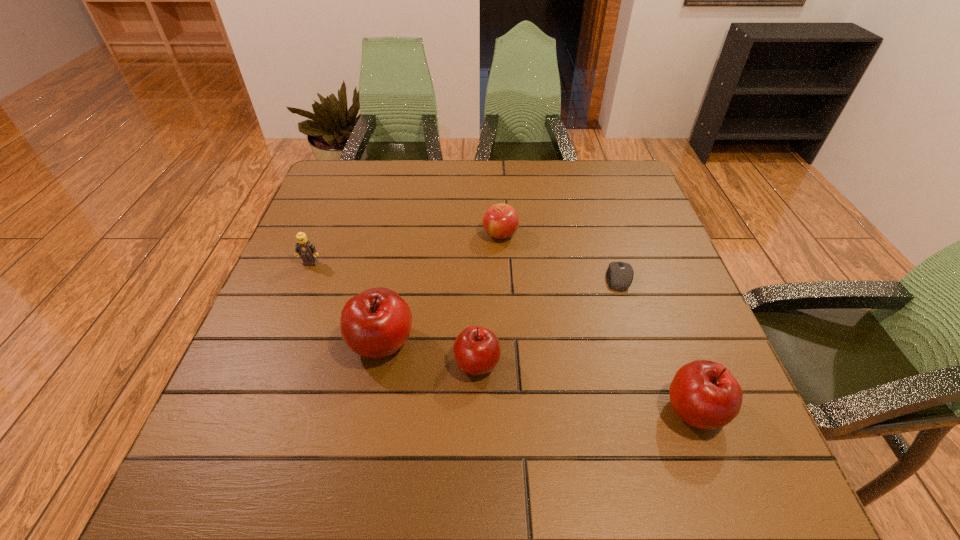
In order to click on spot to insert another apple for uniform distribution in this screenshot , I will do `click(581, 386)`.